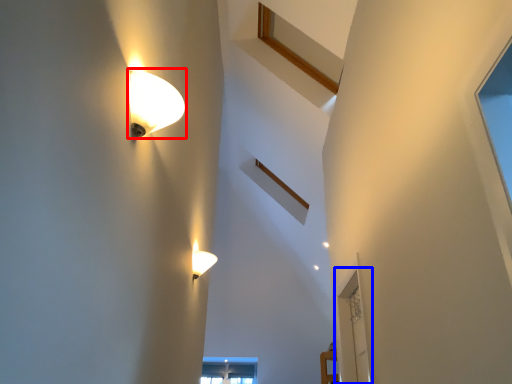
Question: Which object is further to the camera taking this photo, lamp (highlighted by a red box) or glass door (highlighted by a blue box)?

Choices:
 (A) lamp
 (B) glass door

Answer: (B)